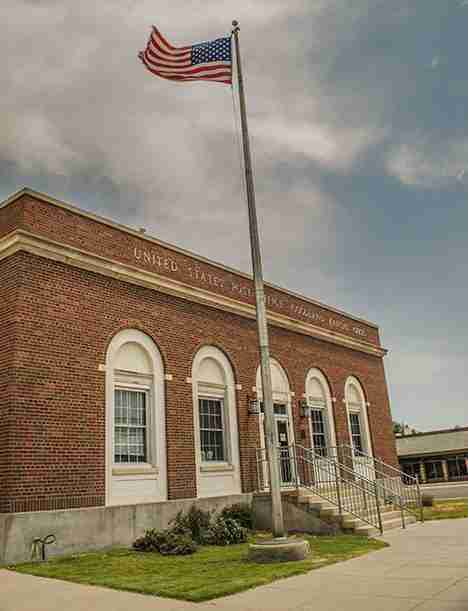
At what (x,y) coordinates should I click in order to perform the action: click on door. Please return your answer as a coordinate pair (x, y). Looking at the image, I should click on (280, 437).